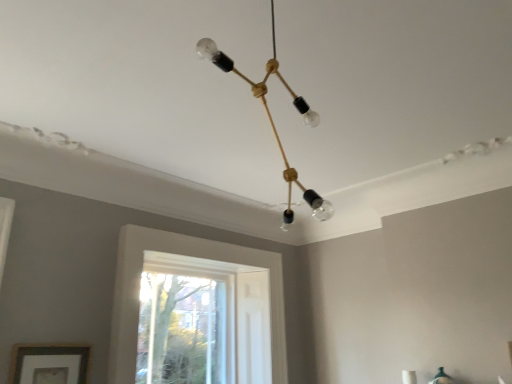
Question: Choose the correct answer: Is clear glass bulb at center inside clear glass window at center or outside it?

Choices:
 (A) inside
 (B) outside

Answer: (B)

Question: Looking at the image, does clear glass bulb at center seem bigger or smaller compared to clear glass window at center?

Choices:
 (A) big
 (B) small

Answer: (A)

Question: Which is nearer to the clear glass bulb at center?

Choices:
 (A) clear glass window at center
 (B) wooden picture frame at lower left

Answer: (B)

Question: Which object is the closest to the clear glass bulb at center?

Choices:
 (A) wooden picture frame at lower left
 (B) clear glass window at center

Answer: (A)